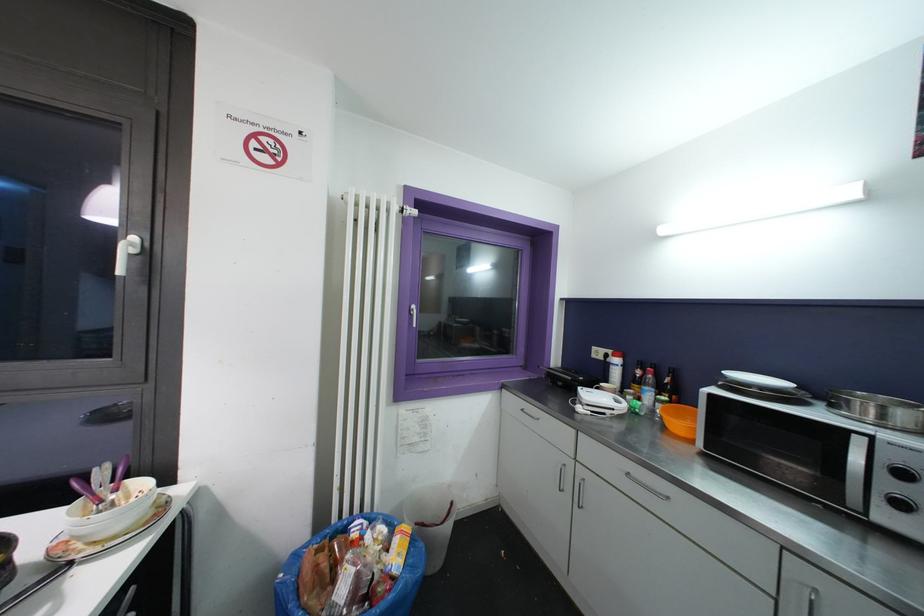
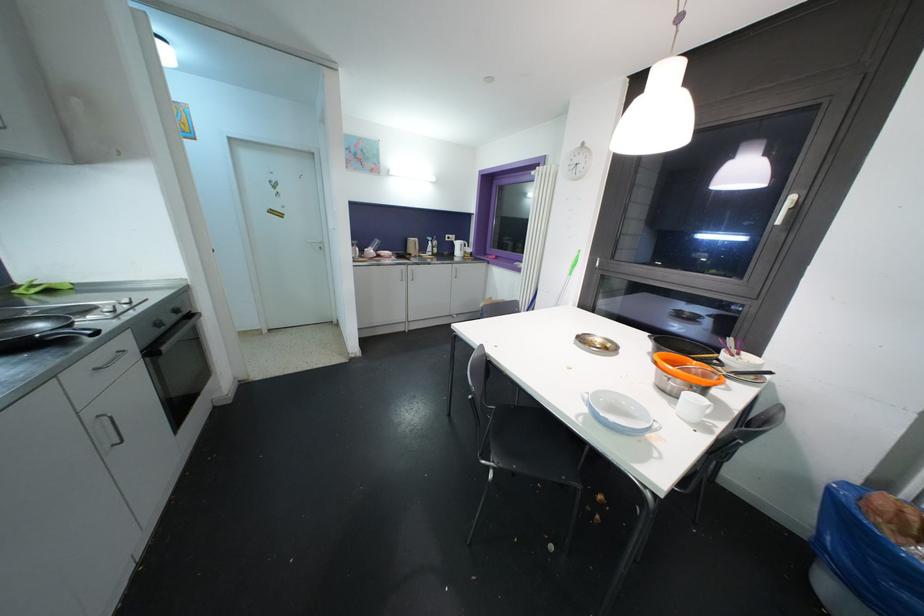
Based on the continuous images, in which direction is the camera rotating?

The camera rotated toward left-down.